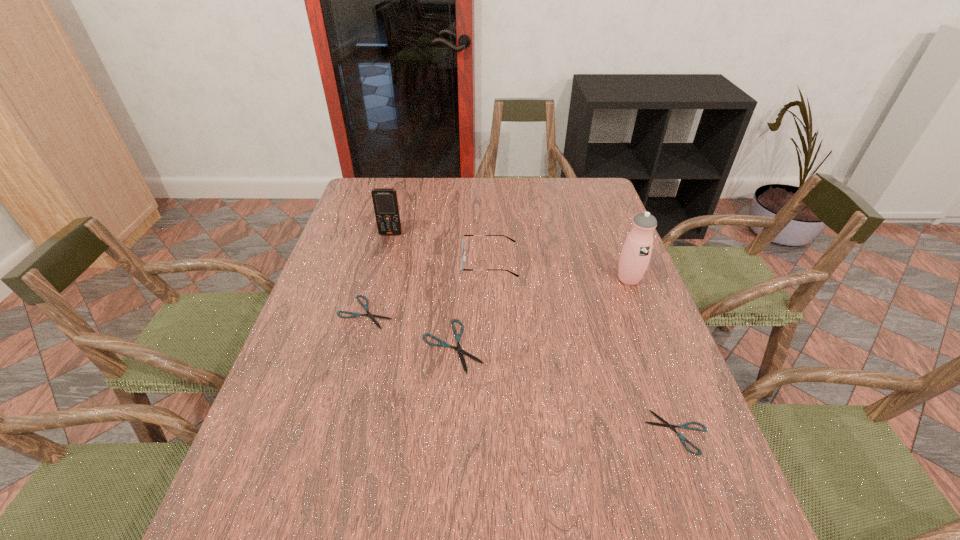
Where is `free region located 0.150m on the right of the second shears from right to left`? This screenshot has height=540, width=960. free region located 0.150m on the right of the second shears from right to left is located at coordinates (545, 346).

The image size is (960, 540). What are the coordinates of `vacant space located 0.250m on the back of the shortest shears` in the screenshot? It's located at (637, 324).

Identify the location of vacant region located 0.250m on the front of the tallest object. (660, 360).

The width and height of the screenshot is (960, 540). What are the coordinates of `vacant space located 0.080m on the lenses of the fourth shortest object` in the screenshot? It's located at tap(436, 262).

Locate an element on the screen. blank space located on the lenses of the fourth shortest object is located at coordinates (336, 262).

Find the location of a particular element. This screenshot has width=960, height=540. free space located 0.280m on the lenses of the fourth shortest object is located at coordinates (369, 262).

Identify the location of free region located 0.090m on the screen of the cellular telephone. (386, 253).

The image size is (960, 540). I want to click on object present at the near edge, so click(685, 426).

I want to click on shears located at the left edge, so click(x=371, y=316).

This screenshot has width=960, height=540. Find the location of `cellular telephone present at the left edge`. cellular telephone present at the left edge is located at coordinates (385, 201).